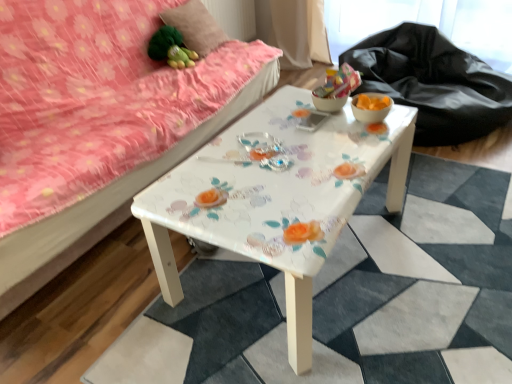
What do you see at coordinates (195, 27) in the screenshot?
I see `fluffy pink pillow at upper left` at bounding box center [195, 27].

Image resolution: width=512 pixels, height=384 pixels. What do you see at coordinates (433, 83) in the screenshot?
I see `black fabric at upper right` at bounding box center [433, 83].

Describe the element at coordinates (277, 197) in the screenshot. This screenshot has height=384, width=512. I see `white glossy table at center` at that location.

This screenshot has height=384, width=512. In order to click on pink floral fabric studio couch at upper left in this screenshot , I will do `click(101, 209)`.

What do you see at coordinates (170, 48) in the screenshot? The image size is (512, 384). I see `green fabric toy at upper left` at bounding box center [170, 48].

What do you see at coordinates (329, 102) in the screenshot? The width and height of the screenshot is (512, 384). I see `translucent glass bowl at center, the 2th glass bowl in the right-to-left sequence` at bounding box center [329, 102].

Locate an element on the screen. This screenshot has height=384, width=512. translucent glass bowl at center, acting as the first glass bowl starting from the left is located at coordinates (329, 102).

From the picture: Measure the distance between point (374, 105) and camera.

Point (374, 105) is 4.85 feet away from camera.

Find the location of `fluffy pink pillow at upper left`. fluffy pink pillow at upper left is located at coordinates (195, 27).

Is matte orange glass bowl at right, the second glass bowl viewed from the left, aimed at pink floral fabric studio couch at upper left?

No, matte orange glass bowl at right, the second glass bowl viewed from the left, is not facing towards pink floral fabric studio couch at upper left.

Does point (387, 103) lie in front of point (33, 261)?

No, (387, 103) is further to viewer.

From the image's perspective, between matte orange glass bowl at right, which is the 1th glass bowl from right to left, and pink floral fabric studio couch at upper left, who is located below?

matte orange glass bowl at right, which is the 1th glass bowl from right to left, appears lower in the image.

Between black fabric at upper right and pink floral fabric studio couch at upper left, which one has more height?

With more height is pink floral fabric studio couch at upper left.

Between point (397, 68) and point (12, 300), which one is positioned behind?

Positioned behind is point (397, 68).

In the scene shown: How much distance is there between black fabric at upper right and pink floral fabric studio couch at upper left?

The distance of black fabric at upper right from pink floral fabric studio couch at upper left is 36.53 inches.

Locate an element on the screen. The height and width of the screenshot is (384, 512). studio couch above the black fabric at upper right (from a real-world perspective) is located at coordinates (101, 209).

From the image's perspective, which one is positioned higher, fluffy pink pillow at upper left or white glossy table at center?

fluffy pink pillow at upper left, from the image's perspective.

Is fluffy pink pillow at upper left looking in the opposite direction of white glossy table at center?

No, white glossy table at center is not at the back of fluffy pink pillow at upper left.

From a real-world perspective, which object stands above the other?

fluffy pink pillow at upper left.

Is fluffy pink pillow at upper left to the left of white glossy table at center from the viewer's perspective?

Yes, fluffy pink pillow at upper left is to the left of white glossy table at center.

Can we say fluffy pink pillow at upper left lies outside translucent glass bowl at center, the 2th glass bowl in the right-to-left sequence?

Yes, fluffy pink pillow at upper left is not within translucent glass bowl at center, the 2th glass bowl in the right-to-left sequence.

Consider the image. Can you confirm if fluffy pink pillow at upper left is bigger than translucent glass bowl at center, acting as the first glass bowl starting from the left?

Yes, fluffy pink pillow at upper left is bigger than translucent glass bowl at center, acting as the first glass bowl starting from the left.

From a real-world perspective, is fluffy pink pillow at upper left below translucent glass bowl at center, acting as the first glass bowl starting from the left?

No, from a real-world perspective, fluffy pink pillow at upper left is not under translucent glass bowl at center, acting as the first glass bowl starting from the left.

Are fluffy pink pillow at upper left and translucent glass bowl at center, the 2th glass bowl in the right-to-left sequence, far apart?

That's right, there is a large distance between fluffy pink pillow at upper left and translucent glass bowl at center, the 2th glass bowl in the right-to-left sequence.

Relative to matte orange glass bowl at right, the second glass bowl viewed from the left, is pink floral fabric studio couch at upper left in front or behind?

In the image, pink floral fabric studio couch at upper left appears in front of matte orange glass bowl at right, the second glass bowl viewed from the left.

From the image's perspective, which object appears higher, pink floral fabric studio couch at upper left or matte orange glass bowl at right, which is the 1th glass bowl from right to left?

pink floral fabric studio couch at upper left.

How many degrees apart are the facing directions of pink floral fabric studio couch at upper left and matte orange glass bowl at right, which is the 1th glass bowl from right to left?

90 degrees separate the facing orientations of pink floral fabric studio couch at upper left and matte orange glass bowl at right, which is the 1th glass bowl from right to left.

Is pink floral fabric studio couch at upper left touching matte orange glass bowl at right, the second glass bowl viewed from the left?

No, pink floral fabric studio couch at upper left is not in contact with matte orange glass bowl at right, the second glass bowl viewed from the left.

How different are the orientations of white glossy table at center and matte orange glass bowl at right, which is the 1th glass bowl from right to left, in degrees?

The facing directions of white glossy table at center and matte orange glass bowl at right, which is the 1th glass bowl from right to left, are 3.9e-05 degrees apart.

Considering the relative sizes of white glossy table at center and matte orange glass bowl at right, the second glass bowl viewed from the left, in the image provided, is white glossy table at center taller than matte orange glass bowl at right, the second glass bowl viewed from the left,?

Correct, white glossy table at center is much taller as matte orange glass bowl at right, the second glass bowl viewed from the left.

From the image's perspective, is white glossy table at center located above or below matte orange glass bowl at right, which is the 1th glass bowl from right to left?

From the image's perspective, white glossy table at center appears below matte orange glass bowl at right, which is the 1th glass bowl from right to left.

In the image, there is a matte orange glass bowl at right, the second glass bowl viewed from the left. What are the coordinates of `table below it (from a real-world perspective)` in the screenshot? It's located at (277, 197).

From a real-world perspective, is pink floral fabric studio couch at upper left physically located above or below fluffy pink pillow at upper left?

Clearly, from a real-world perspective, pink floral fabric studio couch at upper left is below fluffy pink pillow at upper left.

Is fluffy pink pillow at upper left a part of pink floral fabric studio couch at upper left?

Yes, fluffy pink pillow at upper left is a part of pink floral fabric studio couch at upper left.

Find the location of `pillow located behind the pink floral fabric studio couch at upper left`. pillow located behind the pink floral fabric studio couch at upper left is located at coordinates click(x=195, y=27).

From the image's perspective, relative to fluffy pink pillow at upper left, is pink floral fabric studio couch at upper left above or below?

From the image's perspective, pink floral fabric studio couch at upper left appears below fluffy pink pillow at upper left.

Which glass bowl is the 2nd one when counting from the right side of the pink floral fabric studio couch at upper left? Please provide its 2D coordinates.

[(371, 107)]

Where is `sit behind the pink floral fabric studio couch at upper left`? Image resolution: width=512 pixels, height=384 pixels. sit behind the pink floral fabric studio couch at upper left is located at coordinates (433, 83).

Based on their spatial positions, is matte orange glass bowl at right, which is the 1th glass bowl from right to left, or black fabric at upper right further from white glossy table at center?

black fabric at upper right.

Based on the photo, which object lies nearer to the anchor point translucent glass bowl at center, acting as the first glass bowl starting from the left, matte orange glass bowl at right, which is the 1th glass bowl from right to left, or white glossy table at center?

matte orange glass bowl at right, which is the 1th glass bowl from right to left, is closer to translucent glass bowl at center, acting as the first glass bowl starting from the left.

When comparing their distances from white glossy table at center, does green fabric toy at upper left or translucent glass bowl at center, the 2th glass bowl in the right-to-left sequence, seem further?

Based on the image, green fabric toy at upper left appears to be further to white glossy table at center.

Looking at the image, which one is located closer to white glossy table at center, green fabric toy at upper left or matte orange glass bowl at right, the second glass bowl viewed from the left?

The object closer to white glossy table at center is matte orange glass bowl at right, the second glass bowl viewed from the left.

Looking at the image, which one is located further to green fabric toy at upper left, pink floral fabric studio couch at upper left or translucent glass bowl at center, acting as the first glass bowl starting from the left?

translucent glass bowl at center, acting as the first glass bowl starting from the left, is further to green fabric toy at upper left.

From the image, which object appears to be nearer to green fabric toy at upper left, black fabric at upper right or pink floral fabric studio couch at upper left?

pink floral fabric studio couch at upper left is closer to green fabric toy at upper left.

Estimate the real-world distances between objects in this image. Which object is closer to black fabric at upper right, translucent glass bowl at center, the 2th glass bowl in the right-to-left sequence, or white glossy table at center?

Among the two, white glossy table at center is located nearer to black fabric at upper right.

Considering their positions, is pink floral fabric studio couch at upper left positioned closer to matte orange glass bowl at right, which is the 1th glass bowl from right to left, than white glossy table at center?

white glossy table at center.

Where is `table between fluffy pink pillow at upper left and black fabric at upper right`? This screenshot has width=512, height=384. table between fluffy pink pillow at upper left and black fabric at upper right is located at coordinates (277, 197).

This screenshot has width=512, height=384. What are the coordinates of `table situated between pink floral fabric studio couch at upper left and matte orange glass bowl at right, the second glass bowl viewed from the left, from left to right` in the screenshot? It's located at (277, 197).

Locate an element on the screen. Image resolution: width=512 pixels, height=384 pixels. pillow between green fabric toy at upper left and translucent glass bowl at center, acting as the first glass bowl starting from the left, in the horizontal direction is located at coordinates (195, 27).

At what (x,y) coordinates should I click in order to perform the action: click on table between pink floral fabric studio couch at upper left and fluffy pink pillow at upper left from front to back. Please return your answer as a coordinate pair (x, y). This screenshot has height=384, width=512. Looking at the image, I should click on (277, 197).